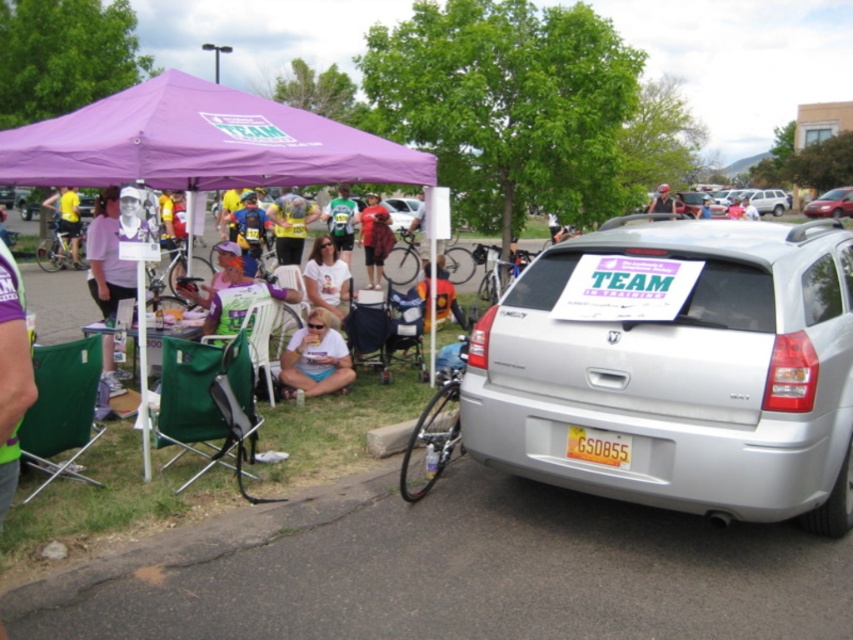
Who is lower down, yellow jersey at center or silver metallic sedan at center?

yellow jersey at center is lower down.

Is point (318, 214) closer to viewer compared to point (389, 198)?

Yes, point (318, 214) is closer to viewer.

At what (x,y) coordinates should I click in order to perform the action: click on yellow jersey at center. Please return your answer as a coordinate pair (x, y). This screenshot has width=853, height=640. Looking at the image, I should click on (289, 225).

Can you confirm if purple fabric canopy at upper center is taller than green fabric shirt at center?

Yes.

Does purple fabric canopy at upper center have a greater width compared to green fabric shirt at center?

Yes.

Does point (213, 141) come farther from viewer compared to point (339, 234)?

No.

Where is `purple fabric canopy at upper center`? Image resolution: width=853 pixels, height=640 pixels. purple fabric canopy at upper center is located at coordinates (200, 141).

Can you confirm if matte white shirt at center is smaller than matte red shorts at center?

Indeed, matte white shirt at center has a smaller size compared to matte red shorts at center.

Does point (322, 392) come closer to viewer compared to point (370, 193)?

Yes, point (322, 392) is closer to viewer.

What are the coordinates of `matte white shirt at center` in the screenshot? It's located at (315, 356).